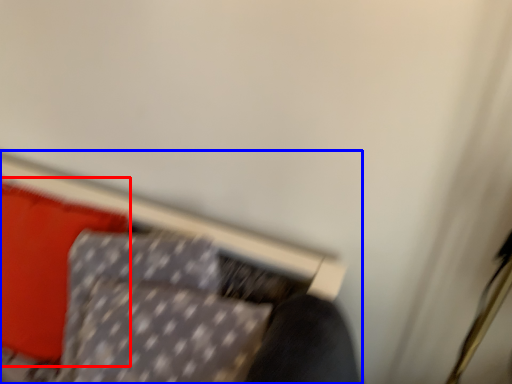
Question: Among these objects, which one is farthest to the camera, pillow (highlighted by a red box) or furniture (highlighted by a blue box)?

Choices:
 (A) pillow
 (B) furniture

Answer: (A)